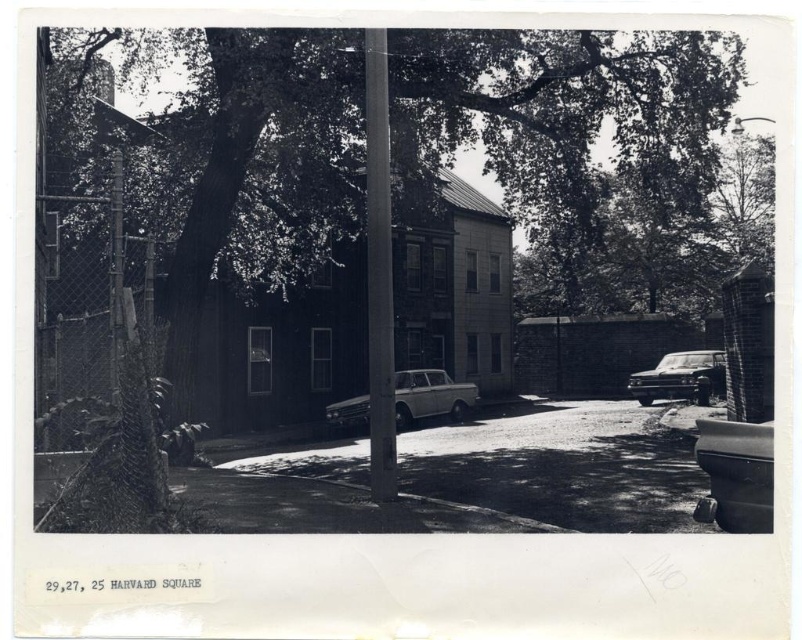
Can you confirm if metallic pole at center is positioned to the right of metallic silver station wagon at center?

Indeed, metallic pole at center is positioned on the right side of metallic silver station wagon at center.

Is point (381, 243) positioned in front of point (408, 403)?

Yes, point (381, 243) is closer to viewer.

Is point (387, 419) positioned behind point (335, 413)?

No.

Where is `metallic pole at center`? The width and height of the screenshot is (802, 640). metallic pole at center is located at coordinates (379, 269).

Does metallic silver station wagon at center appear on the left side of metallic chain-link fence at left?

In fact, metallic silver station wagon at center is to the right of metallic chain-link fence at left.

Is metallic silver station wagon at center taller than metallic chain-link fence at left?

No.

Who is more distant from viewer, (343,410) or (112,381)?

The point (343,410) is behind.

The image size is (802, 640). What are the coordinates of `metallic silver station wagon at center` in the screenshot? It's located at (430, 396).

Which is behind, point (582, 106) or point (476, 392)?

The point (476, 392) is more distant.

In the scene shown: Measure the distance between smooth bark tree at center and metallic silver station wagon at center.

A distance of 11.01 meters exists between smooth bark tree at center and metallic silver station wagon at center.

Who is more distant from viewer, (434, 177) or (339, 412)?

Point (434, 177)

Identify the location of smooth bark tree at center. Image resolution: width=802 pixels, height=640 pixels. (553, 160).